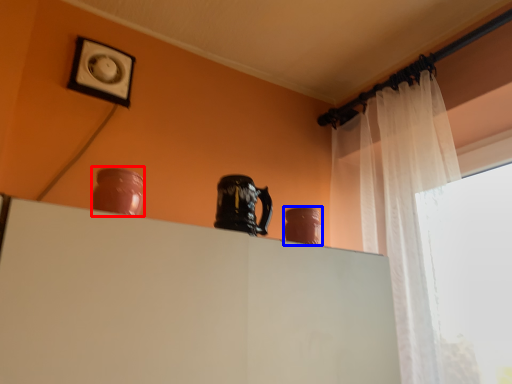
Question: Which object appears farthest to the camera in this image, vase (highlighted by a red box) or vase (highlighted by a blue box)?

Choices:
 (A) vase
 (B) vase

Answer: (B)